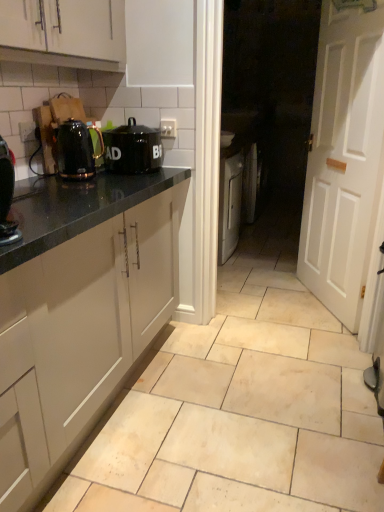
Question: Considering the relative sizes of white wooden door at right and shiny black kettle at left in the image provided, is white wooden door at right shorter than shiny black kettle at left?

Choices:
 (A) yes
 (B) no

Answer: (B)

Question: From a real-world perspective, does white wooden door at right sit lower than shiny black kettle at left?

Choices:
 (A) no
 (B) yes

Answer: (B)

Question: From a real-world perspective, is white wooden door at right over shiny black kettle at left?

Choices:
 (A) no
 (B) yes

Answer: (A)

Question: Is white wooden door at right with shiny black kettle at left?

Choices:
 (A) no
 (B) yes

Answer: (A)

Question: Can you confirm if white wooden door at right is bigger than shiny black kettle at left?

Choices:
 (A) no
 (B) yes

Answer: (B)

Question: Is white wooden door at right taller than shiny black kettle at left?

Choices:
 (A) no
 (B) yes

Answer: (B)

Question: Would you consider black matte canister at upper center to be distant from shiny black kettle at left?

Choices:
 (A) no
 (B) yes

Answer: (A)

Question: Does black matte canister at upper center have a larger size compared to shiny black kettle at left?

Choices:
 (A) no
 (B) yes

Answer: (B)

Question: Can you confirm if black matte canister at upper center is positioned to the left of shiny black kettle at left?

Choices:
 (A) no
 (B) yes

Answer: (A)

Question: Can you confirm if black matte canister at upper center is positioned to the right of shiny black kettle at left?

Choices:
 (A) no
 (B) yes

Answer: (B)

Question: Is black matte canister at upper center turned away from shiny black kettle at left?

Choices:
 (A) yes
 (B) no

Answer: (B)

Question: From the image's perspective, is black matte canister at upper center over shiny black kettle at left?

Choices:
 (A) yes
 (B) no

Answer: (A)

Question: From the image's perspective, is beige ceramic tile at center below shiny black kettle at left?

Choices:
 (A) no
 (B) yes

Answer: (B)